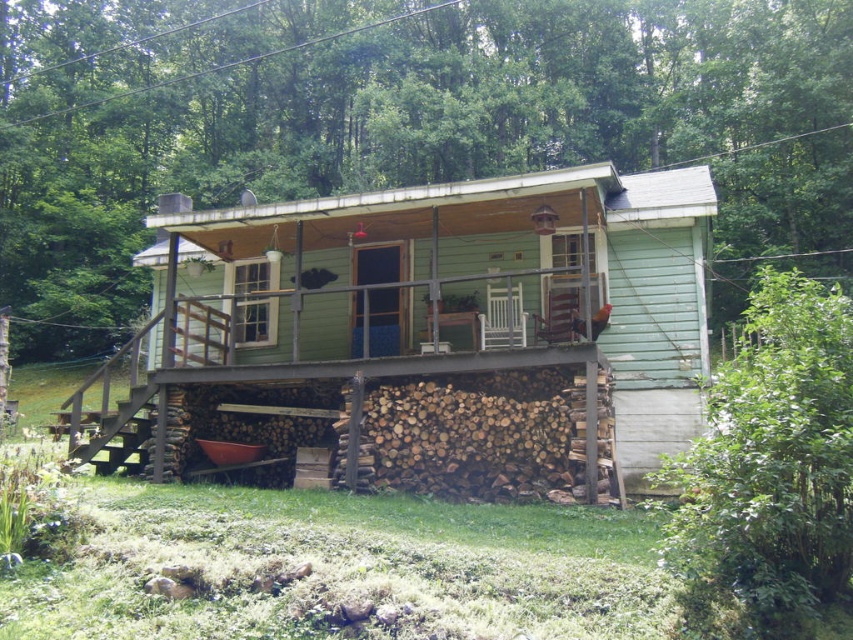
You are planning to build a new deck that needs to be wider than the green wooden cabin at center. Can the deck be built to match the width of the green wooden porch at center?

Yes, the deck can be built to match the width of the green wooden porch at center because the green wooden cabin at center is narrower than the green wooden porch at center.

You are standing in front of the rustic house and want to place a small decoration. You have two points marked on the image where you can place it. The first point is at coordinate point (537,388) and the second is at point (195,298). Which point is closer to you?

Point (537,388) is closer to the camera than point (195,298), so you should place the decoration at point (537,388) if you want it closer to your current position.